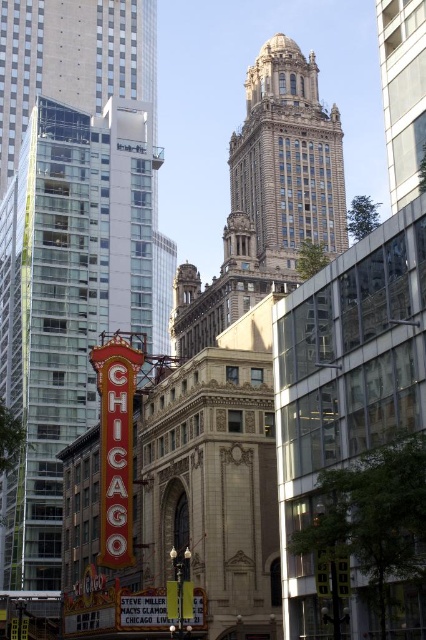
Is red glass building at left taller than brown stone tower at upper center?

Indeed, red glass building at left has a greater height compared to brown stone tower at upper center.

Measure the distance between point [51,360] and camera.

The distance of point [51,360] from camera is 92.65 meters.

The height and width of the screenshot is (640, 426). Find the location of `red glass building at left`. red glass building at left is located at coordinates (68, 300).